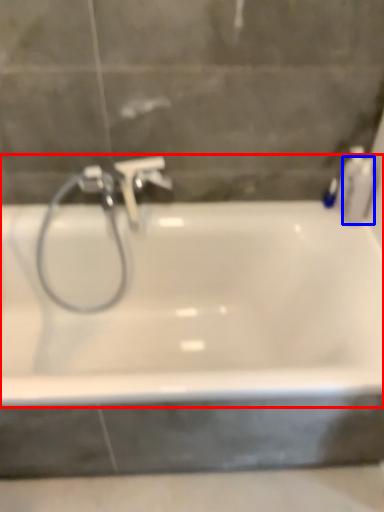
Question: Which of the following is the closest to the observer, bathtub (highlighted by a red box) or toiletry (highlighted by a blue box)?

Choices:
 (A) bathtub
 (B) toiletry

Answer: (A)